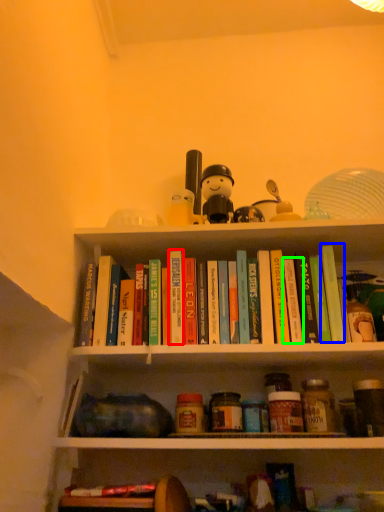
Question: Which object is positioned closest to paperback book (highlighted by a red box)? Select from paperback book (highlighted by a blue box) and paperback book (highlighted by a green box).

Choices:
 (A) paperback book
 (B) paperback book

Answer: (B)